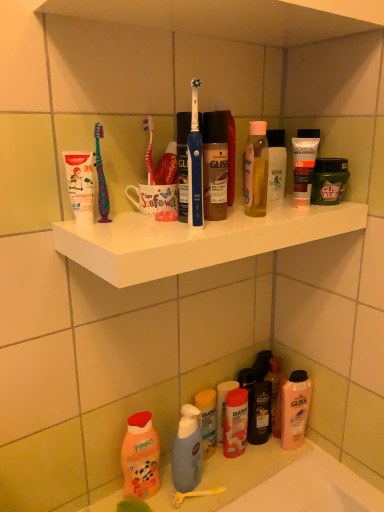
At what (x,y) coordinates should I click in order to perform the action: click on vacant region above translucent plastic bottles at lower center (from a real-world perspective). Please return your answer as a coordinate pair (x, y). This screenshot has height=512, width=384. Looking at the image, I should click on (214, 473).